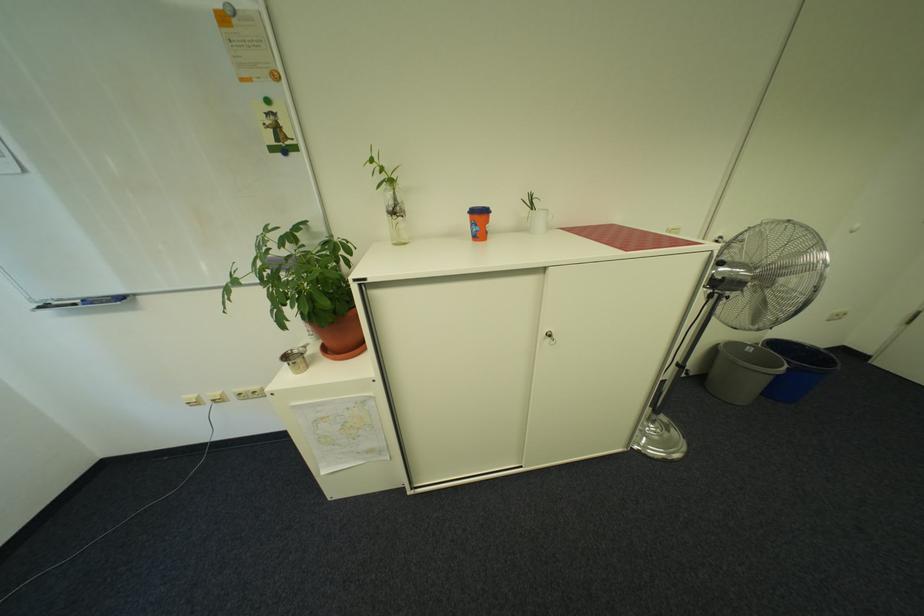
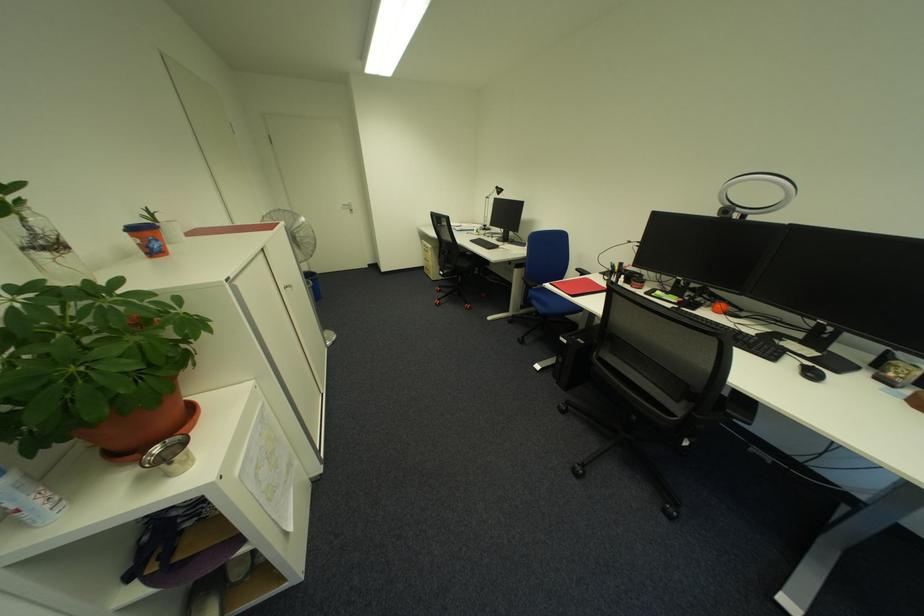
Find the pixel in the second image that matches (x=489, y=237) in the first image.

(164, 254)